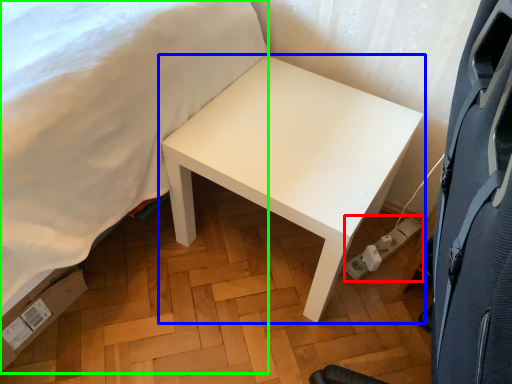
Question: Based on their relative distances, which object is farther from electric outlet (highlighted by a red box)? Choose from table (highlighted by a blue box) and bed (highlighted by a green box).

Choices:
 (A) table
 (B) bed

Answer: (B)